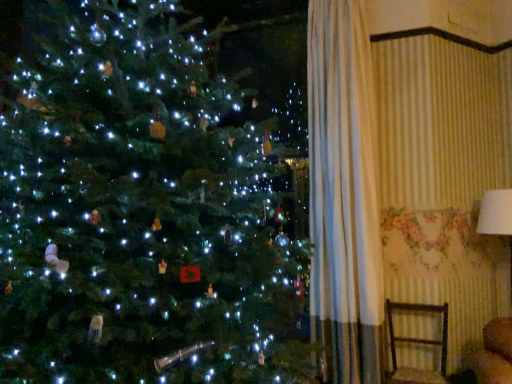
The image size is (512, 384). Describe the element at coordinates (417, 343) in the screenshot. I see `wooden armchair at lower right` at that location.

Find the location of a particular element. wooden armchair at lower right is located at coordinates (417, 343).

This screenshot has height=384, width=512. Identify the location of wooden armchair at lower right. pyautogui.click(x=417, y=343).